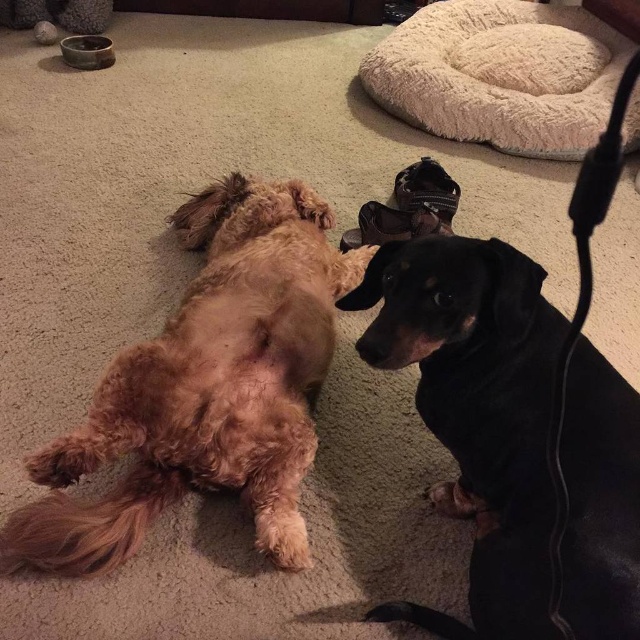
Question: Which point is closer to the camera taking this photo?

Choices:
 (A) (445, 129)
 (B) (497, 584)
 (C) (419, 176)

Answer: (B)

Question: Observing the image, what is the correct spatial positioning of beige fluffy dog bed at upper center in reference to leather/black shoe at center?

Choices:
 (A) left
 (B) right

Answer: (B)

Question: Does fuzzy brown dog at upper left have a greater width compared to leather/black shoe at center?

Choices:
 (A) yes
 (B) no

Answer: (A)

Question: Based on their relative distances, which object is farther from the beige fluffy dog bed at upper center?

Choices:
 (A) black smooth dog at center
 (B) leather/black shoe at center
 (C) fuzzy brown dog at upper left

Answer: (A)

Question: Which object appears closest to the camera in this image?

Choices:
 (A) black smooth dog at center
 (B) fuzzy brown dog at upper left
 (C) beige fluffy dog bed at upper center

Answer: (A)

Question: Can you confirm if fuzzy brown dog at upper left is thinner than black smooth dog at center?

Choices:
 (A) no
 (B) yes

Answer: (A)